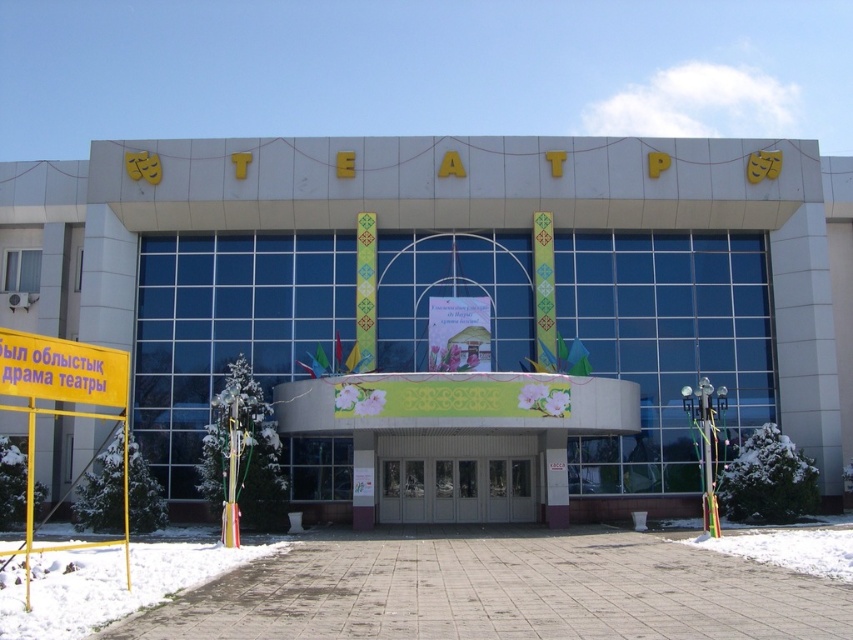
Question: Which is nearer to the white powdery snow at lower center?

Choices:
 (A) yellow/yellowish paper sign at lower left
 (B) metallic glass doors at center
 (C) white powdery snow at lower left

Answer: (B)

Question: Which point is closer to the camera?

Choices:
 (A) yellow/yellowish paper sign at lower left
 (B) white glossy theater at center
 (C) metallic glass doors at center

Answer: (A)

Question: Is white powdery snow at lower left to the right of yellow/yellowish paper sign at lower left from the viewer's perspective?

Choices:
 (A) no
 (B) yes

Answer: (A)

Question: Is white glossy theater at center closer to camera compared to yellow/yellowish paper sign at lower left?

Choices:
 (A) no
 (B) yes

Answer: (A)

Question: Where is white glossy theater at center located in relation to white powdery snow at lower left in the image?

Choices:
 (A) below
 (B) above

Answer: (B)

Question: Which of the following is the closest to the observer?

Choices:
 (A) yellow/yellowish paper sign at lower left
 (B) metallic glass doors at center

Answer: (A)